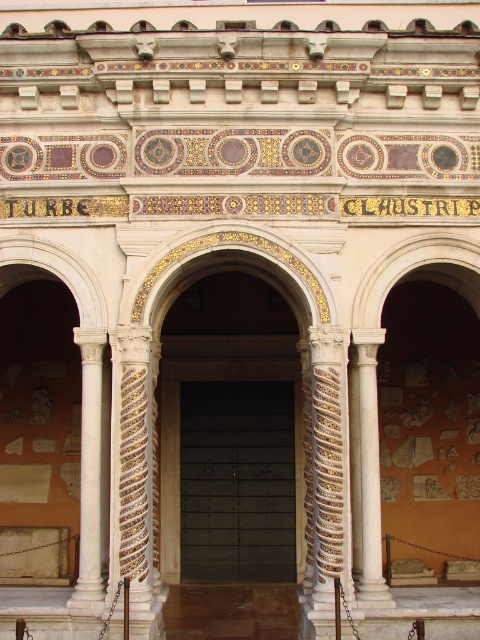
Is point (471, 342) behind point (214, 444)?

Yes, it is.

Is white marble archway at center to the left of black metal door at center from the viewer's perspective?

No, white marble archway at center is not to the left of black metal door at center.

This screenshot has height=640, width=480. What are the coordinates of `white marble archway at center` in the screenshot? It's located at (416, 412).

Is white marble archway at center positioned behind white marble column at left?

Yes.

Between white marble archway at center and white marble column at left, which one is positioned higher?

white marble archway at center is higher up.

Is point (361, 349) behind point (81, 467)?

No, it is not.

Where is `white marble archway at center`? The width and height of the screenshot is (480, 640). white marble archway at center is located at coordinates (416, 412).

Does black metal door at center have a greater width compared to white marble column at left?

Correct, the width of black metal door at center exceeds that of white marble column at left.

Does black metal door at center have a larger size compared to white marble column at left?

Incorrect, black metal door at center is not larger than white marble column at left.

At what (x,y) coordinates should I click in order to perform the action: click on black metal door at center. Please return your answer as a coordinate pair (x, y). Image resolution: width=480 pixels, height=640 pixels. Looking at the image, I should click on (238, 481).